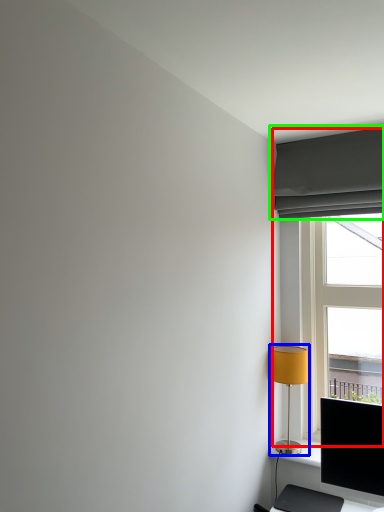
Question: Which object is positioned farthest from window (highlighted by a red box)? Select from lamp (highlighted by a blue box) and curtain (highlighted by a green box).

Choices:
 (A) lamp
 (B) curtain

Answer: (A)